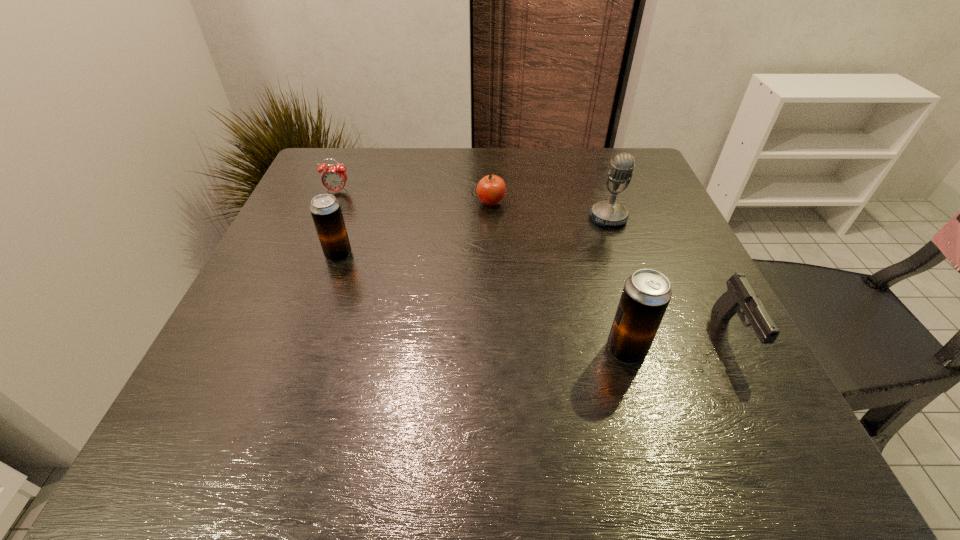
Where is `vacant space that is in between the rightmost object and the fourth object from right to left`? This screenshot has height=540, width=960. vacant space that is in between the rightmost object and the fourth object from right to left is located at coordinates (612, 269).

Find the location of a particular element. The height and width of the screenshot is (540, 960). blank region between the microphone and the taller beer can is located at coordinates (617, 284).

Identify the location of object that is the third closest to the alarm clock. This screenshot has width=960, height=540. point(608,212).

Locate an element on the screen. Image resolution: width=960 pixels, height=540 pixels. object that is the fourth nearest to the microphone is located at coordinates (326, 212).

I want to click on free spot that satisfies the following two spatial constraints: 1. on the front side of the nearer beer can; 2. on the left side of the apple, so click(495, 350).

Where is `free location that satisfies the following two spatial constraints: 1. on the front side of the nearer beer can; 2. on the left side of the third tallest object`? This screenshot has width=960, height=540. free location that satisfies the following two spatial constraints: 1. on the front side of the nearer beer can; 2. on the left side of the third tallest object is located at coordinates coord(305,350).

Where is `free point that satisfies the following two spatial constraints: 1. on the front side of the fourth farthest object; 2. on the left side of the right beer can`? free point that satisfies the following two spatial constraints: 1. on the front side of the fourth farthest object; 2. on the left side of the right beer can is located at coordinates (305, 350).

This screenshot has height=540, width=960. In order to click on vacant area in the image that satisfies the following two spatial constraints: 1. on the back side of the farther beer can; 2. on the left side of the apple in this screenshot , I will do `click(356, 204)`.